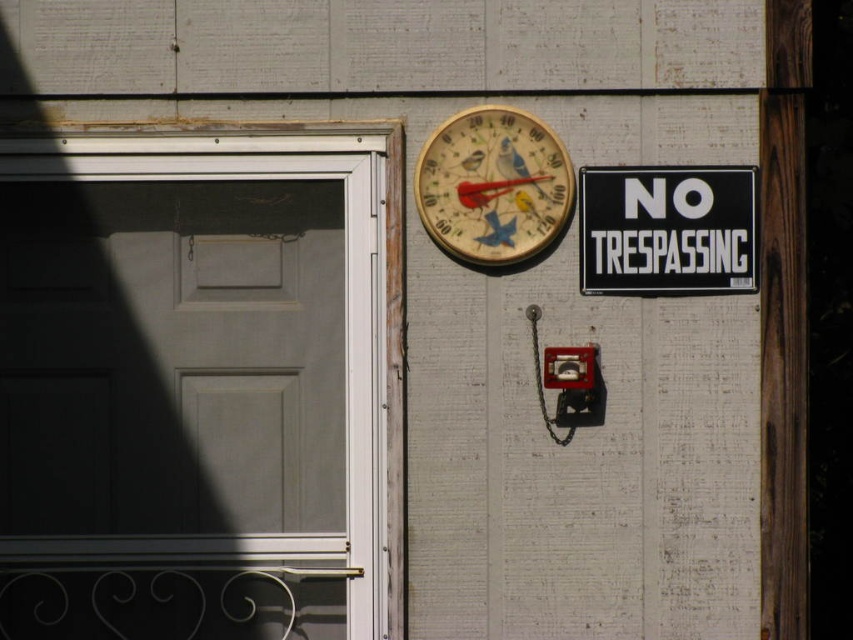
Is matte gray door at left bigger than wooden painted thermometer at upper center?

Correct, matte gray door at left is larger in size than wooden painted thermometer at upper center.

Between point (270, 236) and point (434, 230), which one is positioned behind?

The point (270, 236) is more distant.

Identify the location of matte gray door at left. (196, 385).

The height and width of the screenshot is (640, 853). I want to click on matte gray door at left, so click(196, 385).

Is matte gray door at left to the right of black plastic sign at upper right from the viewer's perspective?

Incorrect, matte gray door at left is not on the right side of black plastic sign at upper right.

This screenshot has height=640, width=853. Describe the element at coordinates (196, 385) in the screenshot. I see `matte gray door at left` at that location.

Image resolution: width=853 pixels, height=640 pixels. In order to click on matte gray door at left in this screenshot , I will do `click(196, 385)`.

Is point (677, 218) closer to viewer compared to point (490, 259)?

No, (677, 218) is further to viewer.

What do you see at coordinates (666, 228) in the screenshot? I see `black plastic sign at upper right` at bounding box center [666, 228].

The image size is (853, 640). I want to click on black plastic sign at upper right, so click(666, 228).